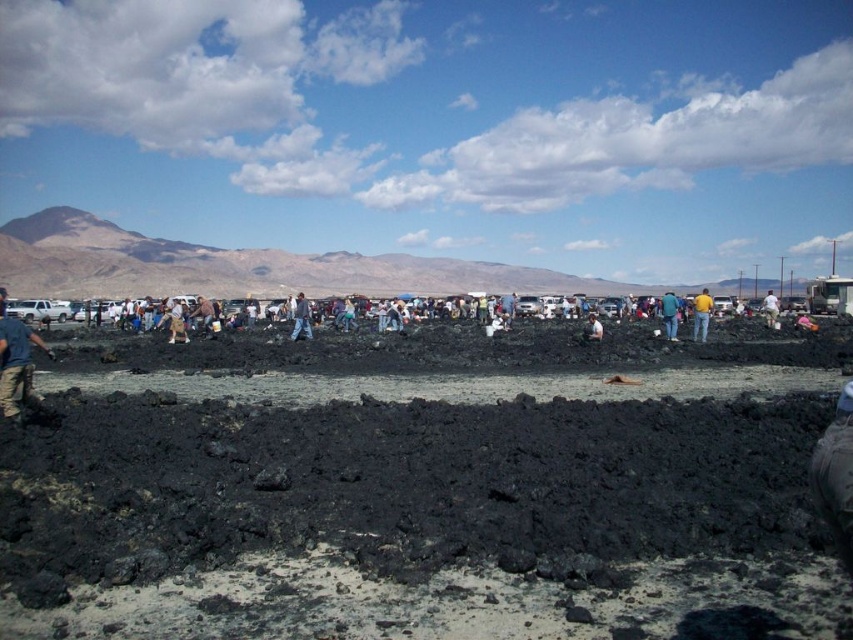
Question: Can you confirm if yellow shirt at center is thinner than light brown fabric bag at center?

Choices:
 (A) no
 (B) yes

Answer: (A)

Question: Which object appears farthest from the camera in this image?

Choices:
 (A) black volcanic mud at center
 (B) blue jeans at lower left
 (C) light brown leather jacket at center

Answer: (C)

Question: Which point appears farthest from the camera in this image?

Choices:
 (A) (671, 324)
 (B) (708, 316)

Answer: (A)

Question: Is yellow shirt at center positioned behind gray fabric pants at center?

Choices:
 (A) yes
 (B) no

Answer: (B)

Question: Which object is closer to the camera taking this photo?

Choices:
 (A) brown leather jacket at center
 (B) light brown fabric bag at center
 (C) white cotton shirt at center

Answer: (B)

Question: Does light brown fabric bag at center appear over brown leather jacket at center?

Choices:
 (A) yes
 (B) no

Answer: (A)